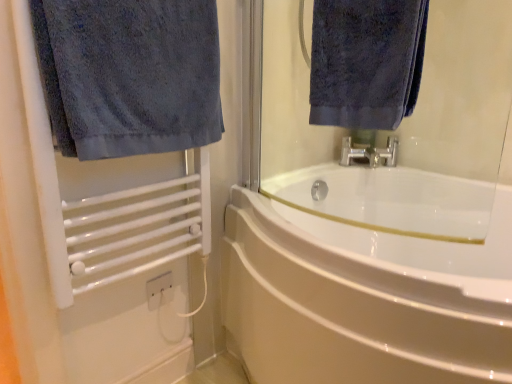
Question: From the image's perspective, is white matte towel rack at left positioned above or below white glossy bathtub at center?

Choices:
 (A) above
 (B) below

Answer: (A)

Question: Considering the positions of white matte towel rack at left and white glossy bathtub at center in the image, is white matte towel rack at left wider or thinner than white glossy bathtub at center?

Choices:
 (A) wide
 (B) thin

Answer: (B)

Question: Which object is positioned farthest from the dark blue terry cloth towel at upper center, placed as the first towel when sorted from right to left?

Choices:
 (A) white matte towel rack at left
 (B) white glossy bathtub at center
 (C) dark blue terry cloth towel at left, arranged as the first towel when viewed from the left

Answer: (A)

Question: Which is farther from the white glossy bathtub at center?

Choices:
 (A) dark blue terry cloth towel at left, arranged as the first towel when viewed from the left
 (B) white matte towel rack at left
 (C) dark blue terry cloth towel at upper center, placed as the first towel when sorted from right to left

Answer: (A)